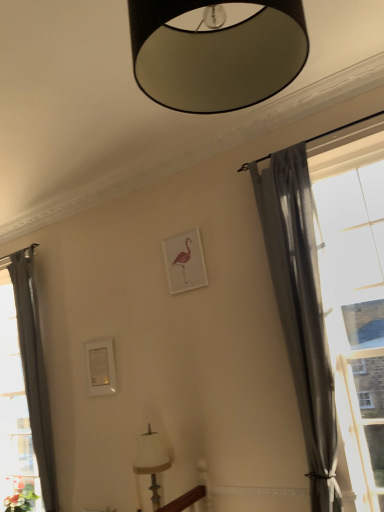
Question: Looking at the image, does gray sheer curtain at right, which is the 2th curtain from back to front, seem bigger or smaller compared to white matte picture frame at center?

Choices:
 (A) big
 (B) small

Answer: (A)

Question: Is gray sheer curtain at right, the first curtain when ordered from right to left, wider or thinner than white matte picture frame at center?

Choices:
 (A) thin
 (B) wide

Answer: (B)

Question: Which is nearer to the black matte lampshade at upper center, the second lamp in the bottom-to-top sequence?

Choices:
 (A) white fabric lampshade at lower center, the first lamp when ordered from bottom to top
 (B) transparent glass window at right
 (C) white matte picture frame at center
 (D) green matte plant at lower left
 (E) gray sheer curtain at right, which is the 2th curtain from back to front

Answer: (E)

Question: Estimate the real-world distances between objects in this image. Which object is closer to the white fabric lampshade at lower center, the first lamp when ordered from bottom to top?

Choices:
 (A) black matte lampshade at upper center, which ranks as the second lamp in back-to-front order
 (B) gray sheer curtain at left, the 2th curtain in the right-to-left sequence
 (C) gray sheer curtain at right, the second curtain from the left
 (D) white matte picture frame at center
 (E) green matte plant at lower left

Answer: (D)